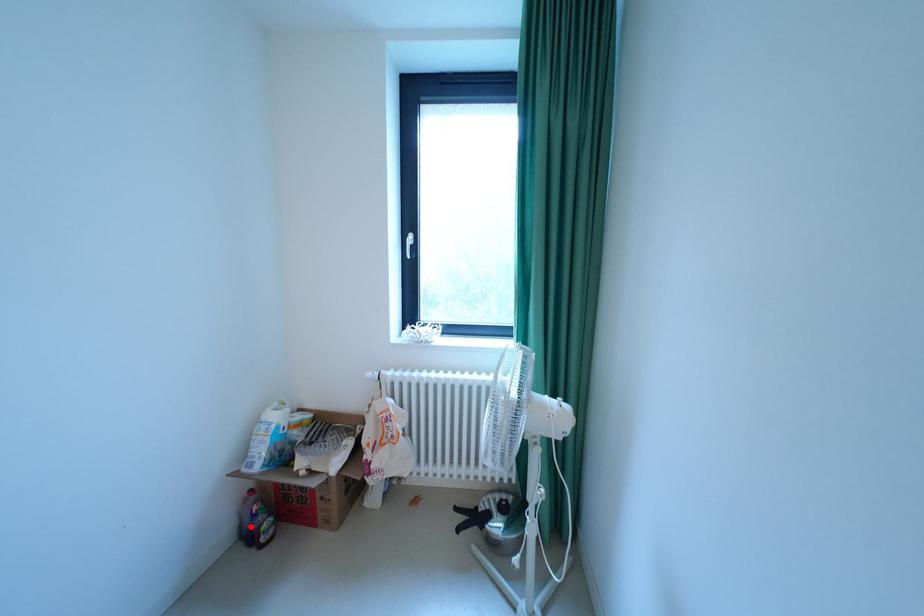
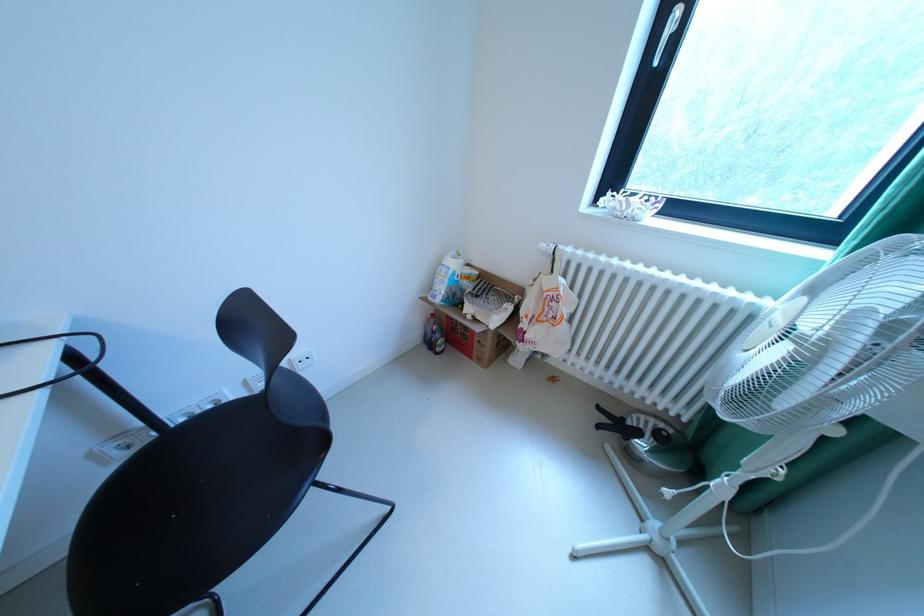
Find the pixel in the second image that matches the highlighted location in the first image.

(435, 334)